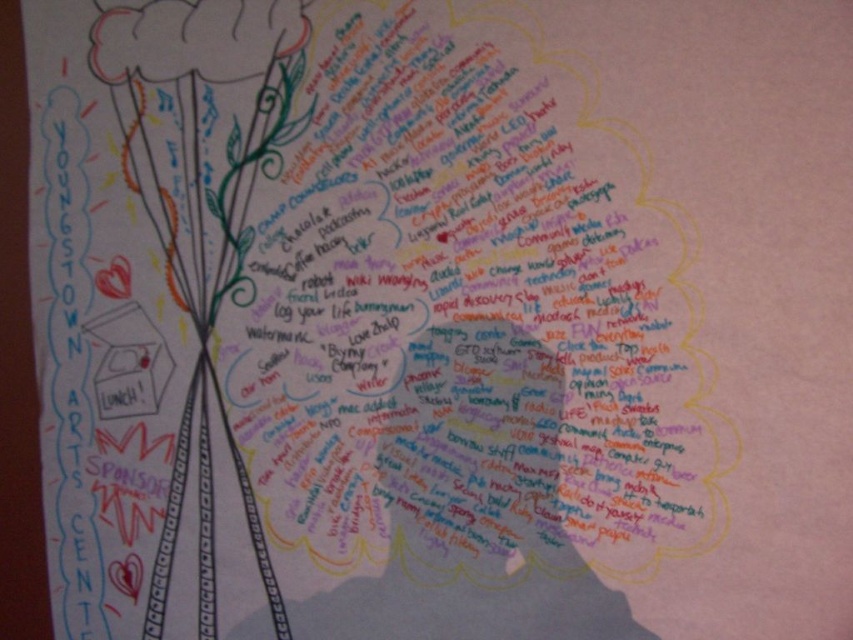
Measure the distance from green leafy tree at center to matte paper flower at upper left.

The distance of green leafy tree at center from matte paper flower at upper left is 4.63 inches.

Which is below, green leafy tree at center or matte paper flower at upper left?

green leafy tree at center is lower down.

Which is behind, point (161, 65) or point (190, 4)?

The point (161, 65) is more distant.

Find the location of a particular element. This screenshot has height=640, width=853. green leafy tree at center is located at coordinates (202, 216).